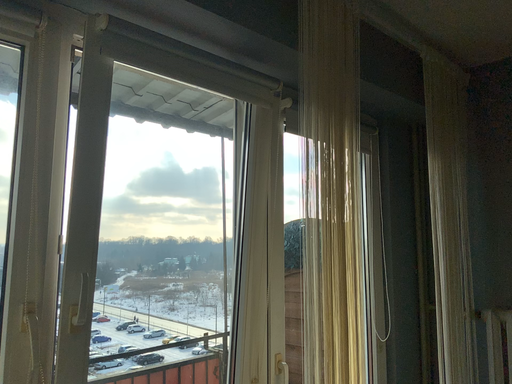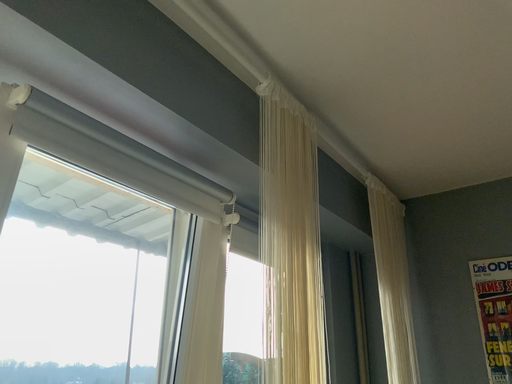
Question: How did the camera likely rotate when shooting the video?

Choices:
 (A) rotated right
 (B) rotated left

Answer: (A)